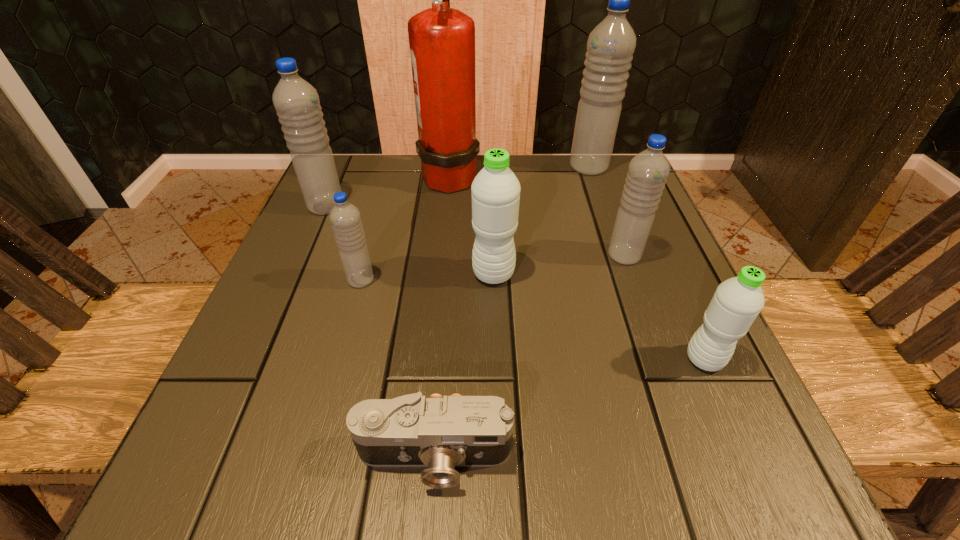
In order to click on the nearest blue water bottle in this screenshot , I will do `click(345, 218)`.

Identify the location of the smaller green water bottle. (737, 302).

I want to click on the seventh farthest object, so click(x=737, y=302).

You are a GUI agent. You are given a task and a screenshot of the screen. Output one action in this format:
    pyautogui.click(x=<x>, y=<y>)
    Task: Click on the camera
    
    Given the screenshot: What is the action you would take?
    pyautogui.click(x=441, y=433)

Identify the location of the nearest object. (441, 433).

Locate an element on the screen. free spot located at the nozzle of the tallest object is located at coordinates (514, 175).

Find the location of a particular element. This screenshot has width=960, height=540. free location located on the right of the tallest water bottle is located at coordinates (634, 167).

This screenshot has height=540, width=960. Identify the location of blank space located 0.120m on the front of the third tallest object. (305, 255).

Identify the location of blank space located on the front of the farther green water bottle. The image size is (960, 540). (498, 415).

You are a GUI agent. You are given a task and a screenshot of the screen. Output one action in this format:
    pyautogui.click(x=<x>, y=<y>)
    Task: Click on the free space located on the front of the second smallest blue water bottle
    The height and width of the screenshot is (540, 960).
    Given the screenshot: What is the action you would take?
    pyautogui.click(x=647, y=321)